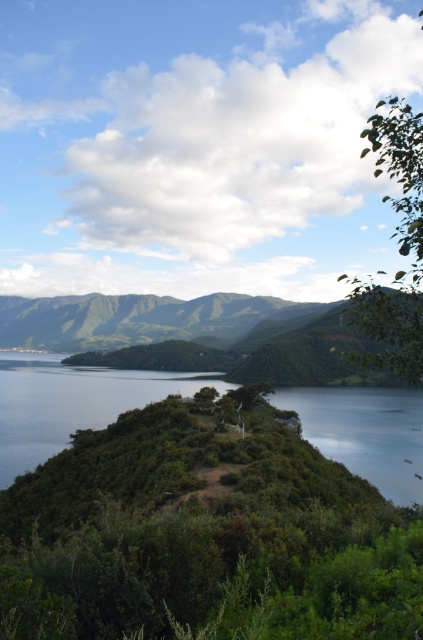
Looking at this image, you are a hiker standing at the base of the green leafy mountain at center and want to reach the green leafy shrubs at center. Which direction should you go to get closer to the shrubs?

The green leafy shrubs at center are smaller in size compared to the green leafy mountain at center, so you should go downhill to reach the green leafy shrubs at center.

You are standing on the dirt path through the hill and want to reach the water. Which object, the green leafy shrubs at center or the green leafy mountain at center, is closer to you?

The green leafy shrubs at center is closer to you because it is positioned below the green leafy mountain at center, indicating it is nearer in the scene.

You are planning a hiking trip and want to know the best path. Which of the two objects, the green leafy shrubs at center or the green leafy mountain at center, is narrower and thus easier to navigate around?

The green leafy shrubs at center is thinner than the green leafy mountain at center, so it is narrower and easier to navigate around.